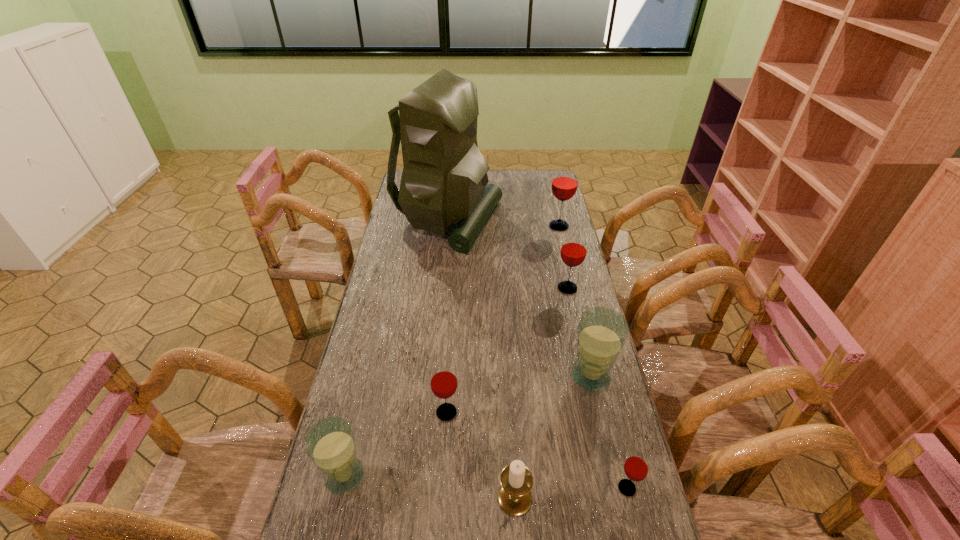
Find the location of `vacant space in between the backpack and the farther blue glass`. vacant space in between the backpack and the farther blue glass is located at coordinates (519, 298).

Where is `free space between the nearest red glass and the backpack`? free space between the nearest red glass and the backpack is located at coordinates (538, 354).

You are a GUI agent. You are given a task and a screenshot of the screen. Output one action in this format:
    pyautogui.click(x=<x>, y=<y>)
    Task: Click on the unoccupied area between the fifth glass from right to left and the bigger blue glass
    
    Given the screenshot: What is the action you would take?
    pyautogui.click(x=518, y=394)

Identify the location of empty space that is in between the tallest object and the fourth nearest object. (447, 316).

At what (x,y) coordinates should I click in order to perform the action: click on vacant space in between the fourth nearest glass and the green backpack. Please return your answer as a coordinate pair (x, y). The image size is (960, 540). Looking at the image, I should click on (519, 298).

Choose which object is the seventh nearest neighbor to the fourth nearest object. Please provide its 2D coordinates. Your answer should be formatted as a tuple, i.e. [(x, y)], where the tuple contains the x and y coordinates of a point satisfying the conditions above.

[(564, 185)]

Locate which object is the second closest to the nearer blue glass. Please provide its 2D coordinates. Your answer should be formatted as a tuple, i.e. [(x, y)], where the tuple contains the x and y coordinates of a point satisfying the conditions above.

[(514, 497)]

Locate an element on the screen. the third closest glass to the smaller blue glass is located at coordinates (636, 467).

Identify which glass is the third closest to the smallest red glass. Please provide its 2D coordinates. Your answer should be formatted as a tuple, i.e. [(x, y)], where the tuple contains the x and y coordinates of a point satisfying the conditions above.

[(330, 444)]

Identify which red glass is located as the third nearest to the smallest red glass. Please provide its 2D coordinates. Your answer should be formatted as a tuple, i.e. [(x, y)], where the tuple contains the x and y coordinates of a point satisfying the conditions above.

[(564, 185)]